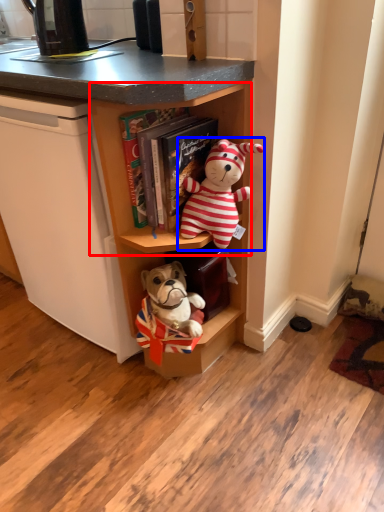
Question: Which of the following is the closest to the observer, cabinet (highlighted by a red box) or toy (highlighted by a blue box)?

Choices:
 (A) cabinet
 (B) toy

Answer: (A)